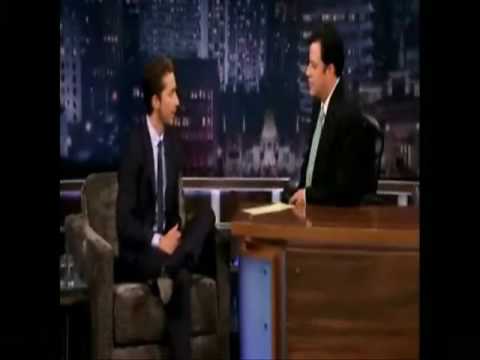
Find the location of a particular element. The height and width of the screenshot is (360, 480). desk is located at coordinates (345, 313).